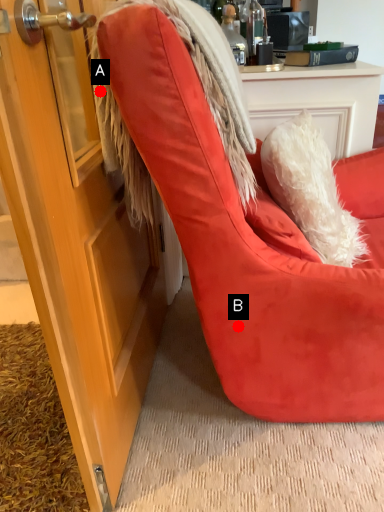
Question: Two points are circled on the image, labeled by A and B beside each circle. Which point is closer to the camera?

Choices:
 (A) A is closer
 (B) B is closer

Answer: (A)